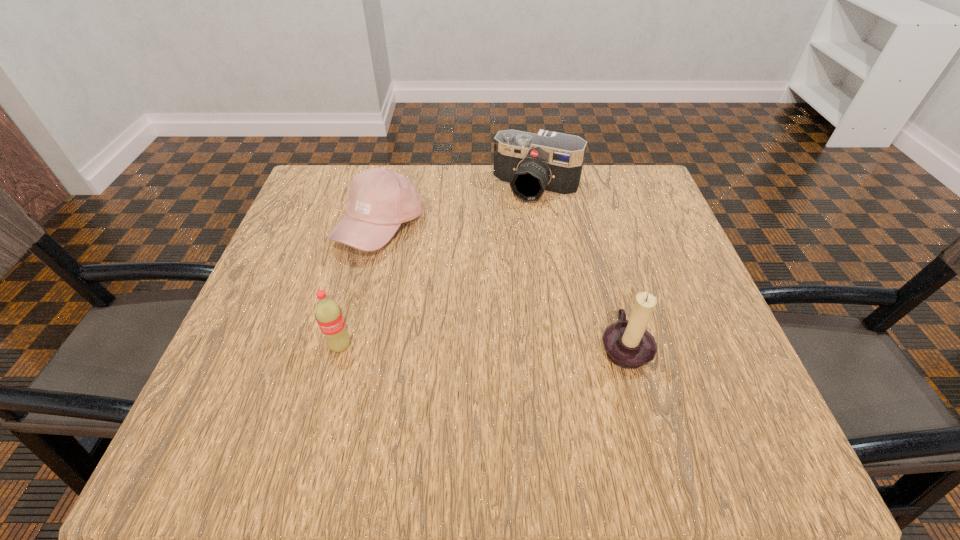
You are a GUI agent. You are given a task and a screenshot of the screen. Output one action in this format:
    pyautogui.click(x=<x>, y=<y>)
    Task: Click on the vacant area at the near edge of the desktop
    The width and height of the screenshot is (960, 540).
    Given the screenshot: What is the action you would take?
    pyautogui.click(x=362, y=382)

Find the location of `free region at the left edge of the desktop`. free region at the left edge of the desktop is located at coordinates (287, 239).

Find the location of a particular element. Image resolution: width=960 pixels, height=540 pixels. vacant area at the right edge is located at coordinates (660, 280).

Locate an element on the screen. vacant space at the far left corner of the desktop is located at coordinates (348, 165).

In the image, there is a desktop. What are the coordinates of `vacant space at the far right corner` in the screenshot? It's located at (644, 210).

Image resolution: width=960 pixels, height=540 pixels. Find the location of `vacant space at the near right corner`. vacant space at the near right corner is located at coordinates (740, 408).

Image resolution: width=960 pixels, height=540 pixels. What are the coordinates of `vacant area that lies between the candle holder and the soda` in the screenshot? It's located at (482, 346).

I want to click on vacant space that's between the candle holder and the camera, so click(580, 267).

This screenshot has height=540, width=960. Identify the location of free point between the camera and the baseball cap. pos(458,208).

This screenshot has height=540, width=960. Identify the location of free space between the camera and the baseball cap. (458, 208).